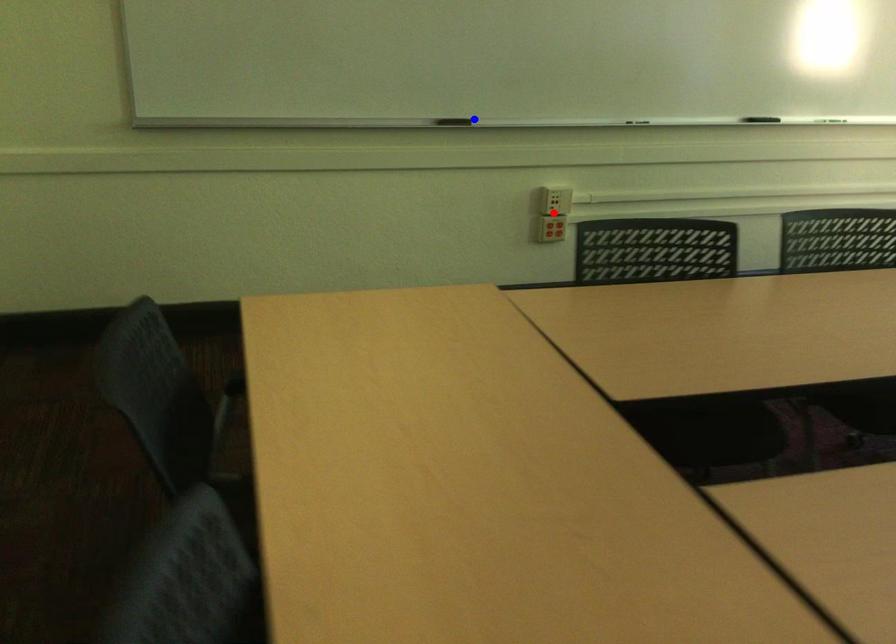
Question: In the image, two points are highlighted. Which point is nearer to the camera? Reply with the corresponding letter.

Choices:
 (A) blue point
 (B) red point

Answer: (A)